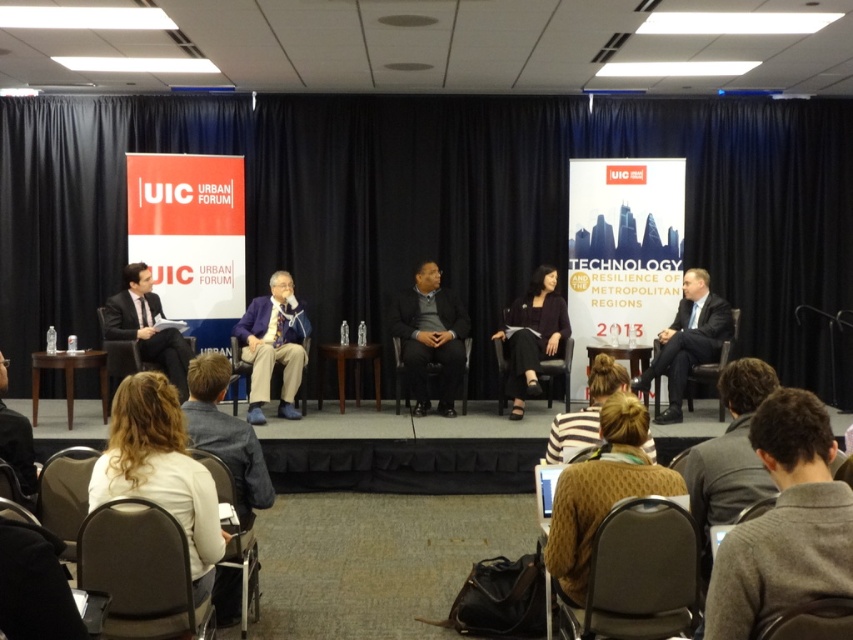
Can you confirm if black leather chair at lower left is thinner than blue fabric chair at center?

In fact, black leather chair at lower left might be wider than blue fabric chair at center.

Can you confirm if black leather chair at lower left is positioned to the left of blue fabric chair at center?

No, black leather chair at lower left is not to the left of blue fabric chair at center.

Does point (144, 627) come farther from viewer compared to point (308, 348)?

No, (144, 627) is in front of (308, 348).

Where is `black leather chair at lower left`? This screenshot has height=640, width=853. black leather chair at lower left is located at coordinates (138, 572).

Can you confirm if velvet brown chair at lower right is shorter than black leather chair at right?

Indeed, velvet brown chair at lower right has a lesser height compared to black leather chair at right.

Is velvet brown chair at lower right smaller than black leather chair at right?

Yes.

Which is in front, point (798, 636) or point (697, 372)?

Positioned in front is point (798, 636).

This screenshot has height=640, width=853. Find the location of `velvet brown chair at lower right`. velvet brown chair at lower right is located at coordinates [811, 620].

Can you confirm if striped knit sweater at center is thinner than black fabric chair at lower left?

Correct, striped knit sweater at center's width is less than black fabric chair at lower left's.

Does point (564, 458) come in front of point (28, 445)?

No, it is behind (28, 445).

Which is behind, point (618, 369) or point (1, 369)?

Point (618, 369)

Locate an element on the screen. striped knit sweater at center is located at coordinates (585, 412).